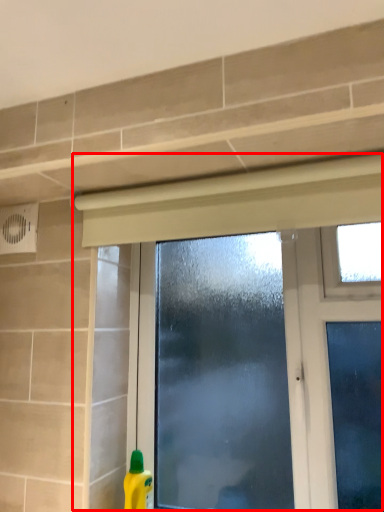
Question: From the image, what is the correct spatial relationship of window (annotated by the red box) in relation to cleaning product?

Choices:
 (A) right
 (B) left

Answer: (A)